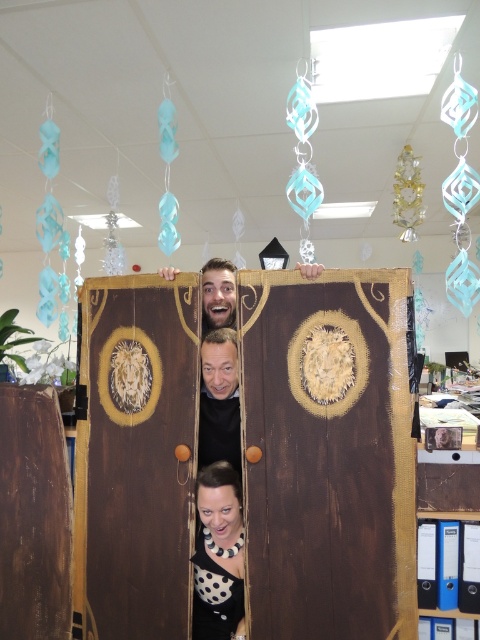
You are standing in an office and want to reach a specific point marked at coordinates point (242, 579). If you are currently 2 meters away from that point, how much further do you need to move forward to reach it?

The distance of point (242, 579) from viewer is 2.17 meters. Since you are currently 2 meters away, you need to move forward an additional 0.17 meters to reach the point.

You are an office worker who needs to hang a new name tag on the smooth brown wooden door at center. However, you notice the polka dot blouse at lower center is in the way. Can you attach the name tag without moving the blouse?

The polka dot blouse at lower center is bigger than the smooth brown wooden door at center, so it might block access to the door. You should move the blouse to avoid obstruction.